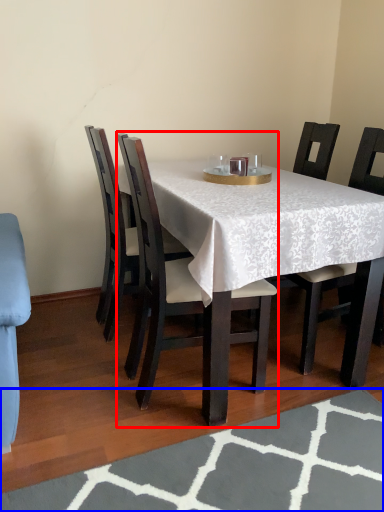
Question: Which point is further to the camera, chair (highlighted by a red box) or place mat (highlighted by a blue box)?

Choices:
 (A) chair
 (B) place mat

Answer: (A)